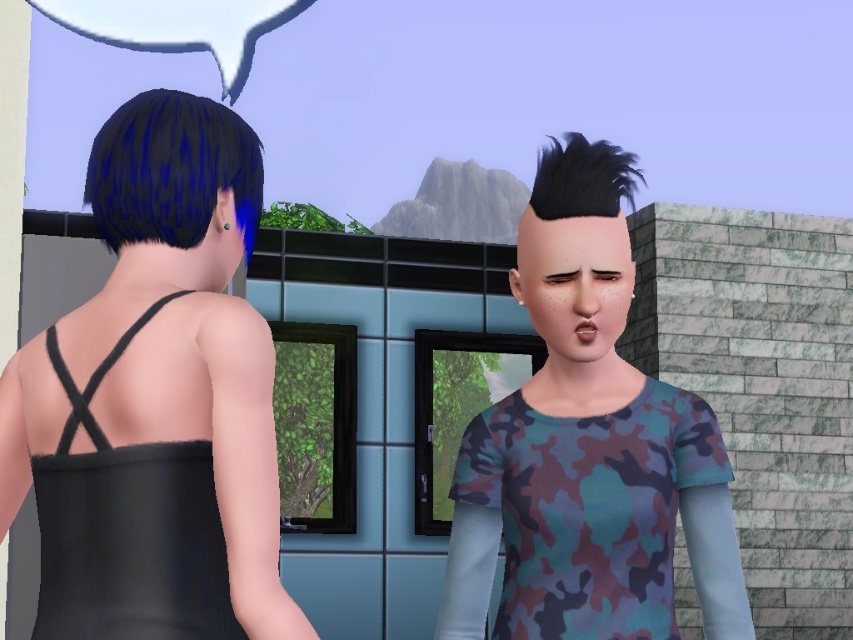
Between camouflage fabric shirt at center and white paper speech bubble at upper center, which one has less height?

With less height is white paper speech bubble at upper center.

Can you confirm if camouflage fabric shirt at center is positioned above white paper speech bubble at upper center?

No.

Which is behind, point (456, 566) or point (113, 16)?

The point (113, 16) is behind.

Where is `camouflage fabric shirt at center`? camouflage fabric shirt at center is located at coordinates (587, 448).

Does point (48, 550) lie in front of point (148, 106)?

Yes, point (48, 550) is in front of point (148, 106).

Is black matte dress at left taller than blue shiny hair at back?

Correct, black matte dress at left is much taller as blue shiny hair at back.

The width and height of the screenshot is (853, 640). I want to click on black matte dress at left, so click(x=155, y=397).

In order to click on black matte dress at left in this screenshot , I will do `click(155, 397)`.

Can you confirm if camouflage fabric shirt at center is thinner than camouflage fabric at center?

No.

Is camouflage fabric shirt at center bigger than camouflage fabric at center?

Correct, camouflage fabric shirt at center is larger in size than camouflage fabric at center.

What do you see at coordinates (587, 448) in the screenshot? I see `camouflage fabric shirt at center` at bounding box center [587, 448].

Find the location of a particular element. The image size is (853, 640). camouflage fabric shirt at center is located at coordinates (587, 448).